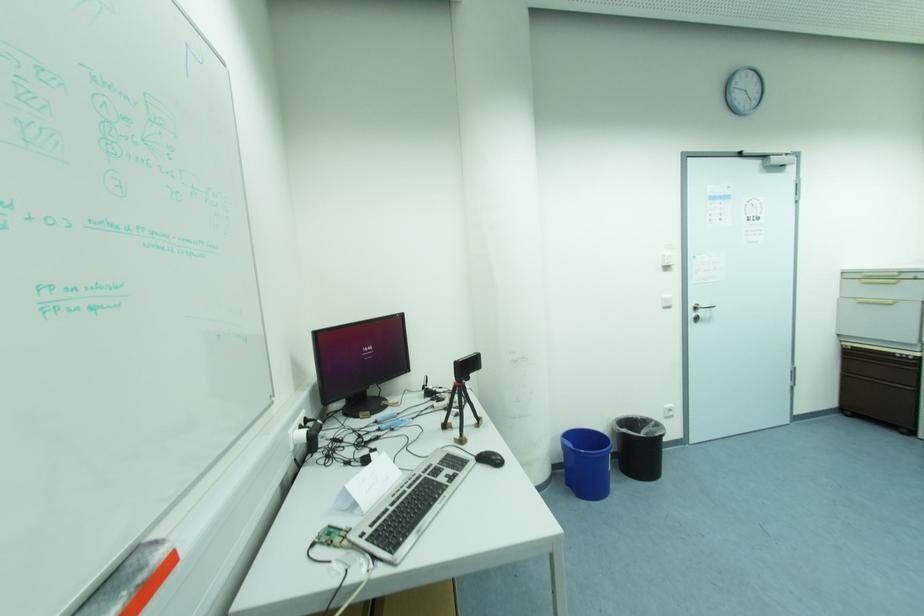
The height and width of the screenshot is (616, 924). Identify the location of silver door handle. (701, 308).